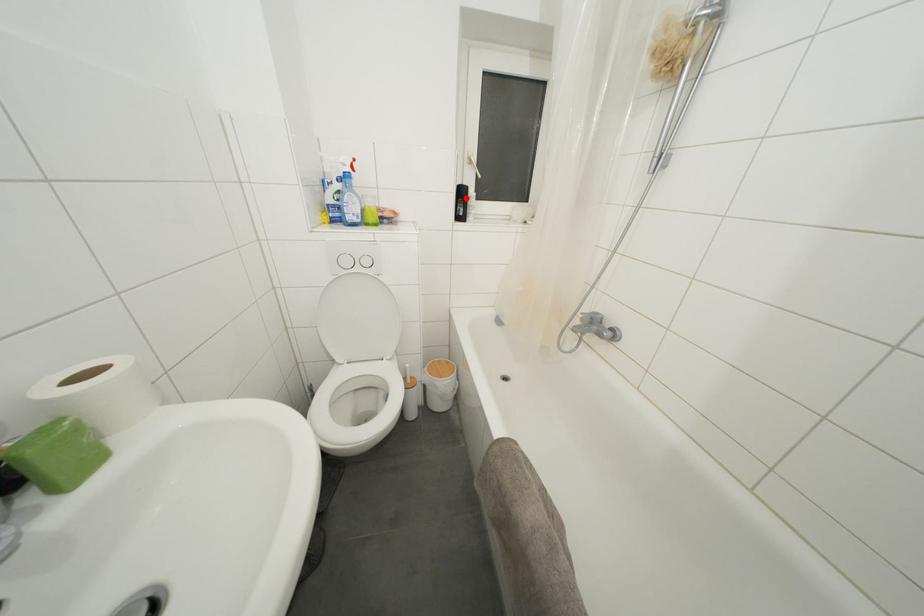
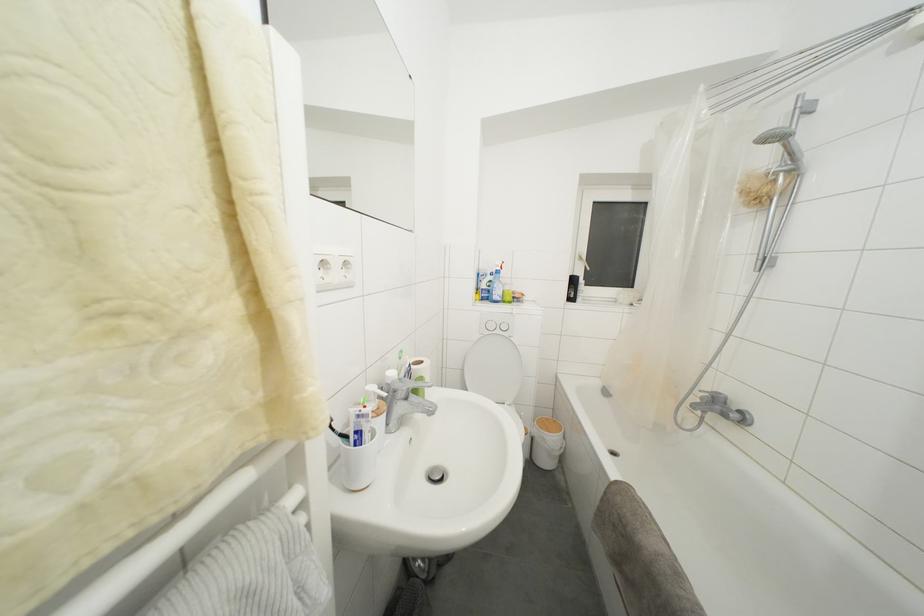
In the second image, find the point that corresponds to the highlighted location in the first image.

(578, 286)